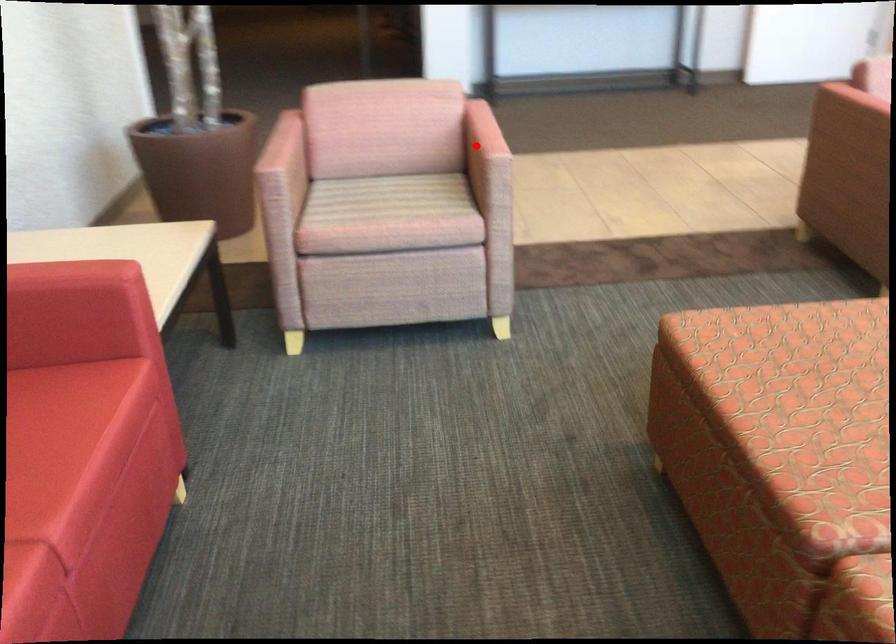
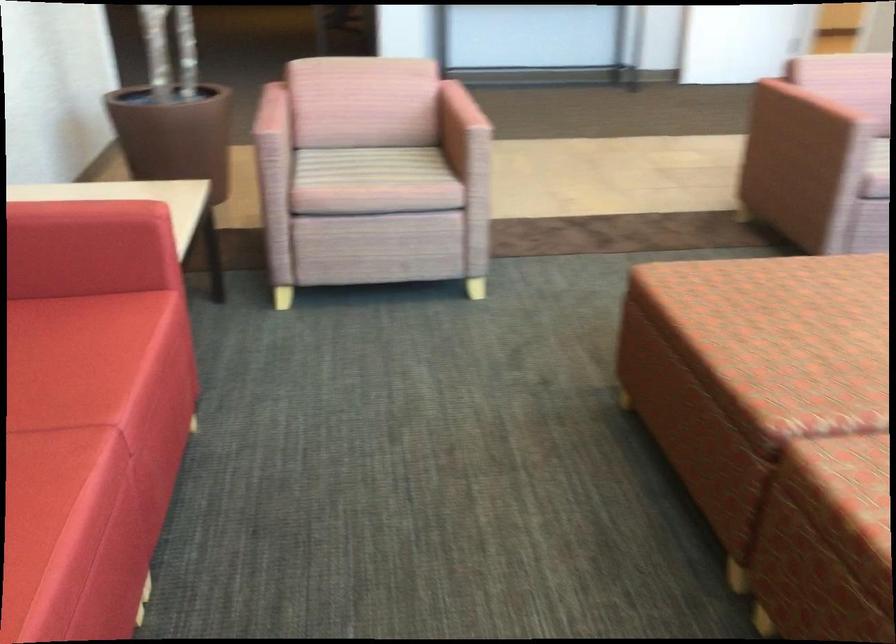
The point at the highlighted location is marked in the first image. Where is the corresponding point in the second image?

(459, 118)